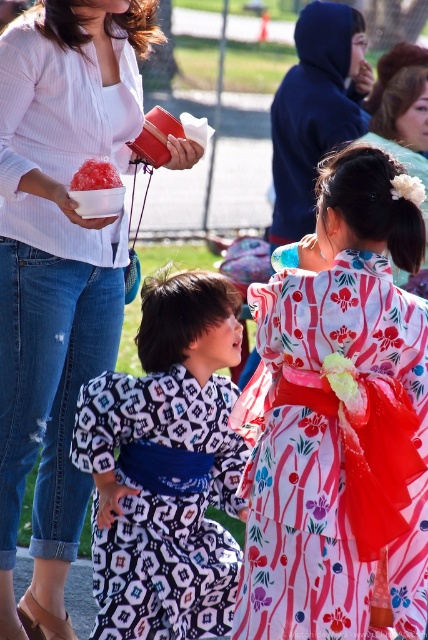
Question: Among these objects, which one is nearest to the camera?

Choices:
 (A) patterned silk kimono at center
 (B) floral kimono at center
 (C) white ribbed sweater at upper left

Answer: (A)

Question: Which point is farther to the camera?

Choices:
 (A) (306, 556)
 (B) (42, 289)

Answer: (B)

Question: Which object appears farthest from the camera in this image?

Choices:
 (A) floral kimono at center
 (B) patterned silk kimono at center

Answer: (A)

Question: From the image, what is the correct spatial relationship of patterned silk kimono at center in relation to shiny pink ice at center?

Choices:
 (A) left
 (B) right

Answer: (B)

Question: Is patterned silk kimono at center to the right of floral kimono at center from the viewer's perspective?

Choices:
 (A) no
 (B) yes

Answer: (A)

Question: Is white ribbed sweater at upper left positioned in front of white floral kimono at center?

Choices:
 (A) no
 (B) yes

Answer: (A)